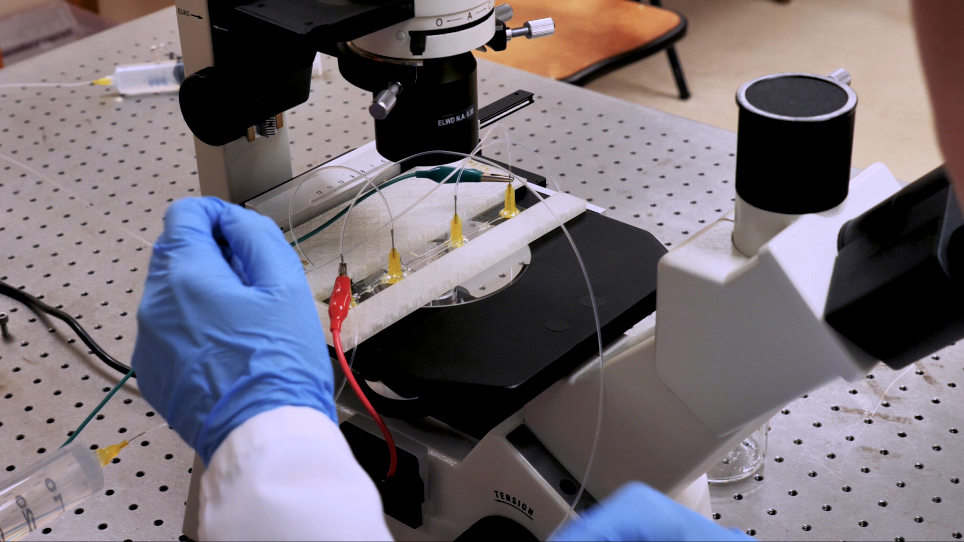
Identify the location of floor. (771, 41).